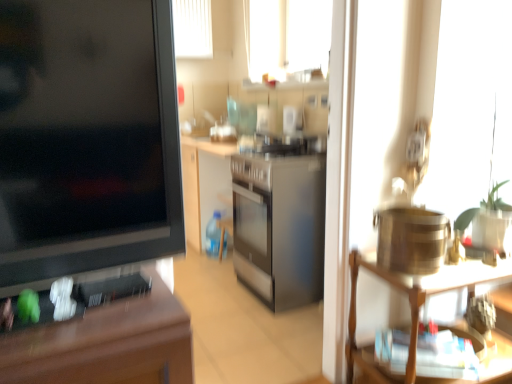
Question: Can you confirm if wooden desk at left is thinner than wooden shelf at right?

Choices:
 (A) no
 (B) yes

Answer: (B)

Question: Is wooden desk at left turned away from wooden shelf at right?

Choices:
 (A) no
 (B) yes

Answer: (A)

Question: Is wooden desk at left smaller than wooden shelf at right?

Choices:
 (A) no
 (B) yes

Answer: (B)

Question: From a real-world perspective, is wooden desk at left physically below wooden shelf at right?

Choices:
 (A) yes
 (B) no

Answer: (B)

Question: Considering the relative positions of wooden desk at left and wooden shelf at right in the image provided, is wooden desk at left in front of wooden shelf at right?

Choices:
 (A) no
 (B) yes

Answer: (B)

Question: Is wooden desk at left far away from wooden shelf at right?

Choices:
 (A) no
 (B) yes

Answer: (A)

Question: Does wooden shelf at right contain wooden desk at left?

Choices:
 (A) yes
 (B) no

Answer: (B)

Question: Can you confirm if wooden shelf at right is wider than wooden desk at left?

Choices:
 (A) no
 (B) yes

Answer: (B)

Question: Considering the relative sizes of wooden shelf at right and wooden desk at left in the image provided, is wooden shelf at right smaller than wooden desk at left?

Choices:
 (A) yes
 (B) no

Answer: (B)

Question: Would you consider wooden shelf at right to be distant from wooden desk at left?

Choices:
 (A) yes
 (B) no

Answer: (B)

Question: Can you confirm if wooden shelf at right is thinner than wooden desk at left?

Choices:
 (A) no
 (B) yes

Answer: (A)

Question: Is wooden shelf at right to the right of wooden desk at left from the viewer's perspective?

Choices:
 (A) yes
 (B) no

Answer: (A)

Question: From a real-world perspective, is wooden desk at left positioned above or below wooden shelf at right?

Choices:
 (A) below
 (B) above

Answer: (B)